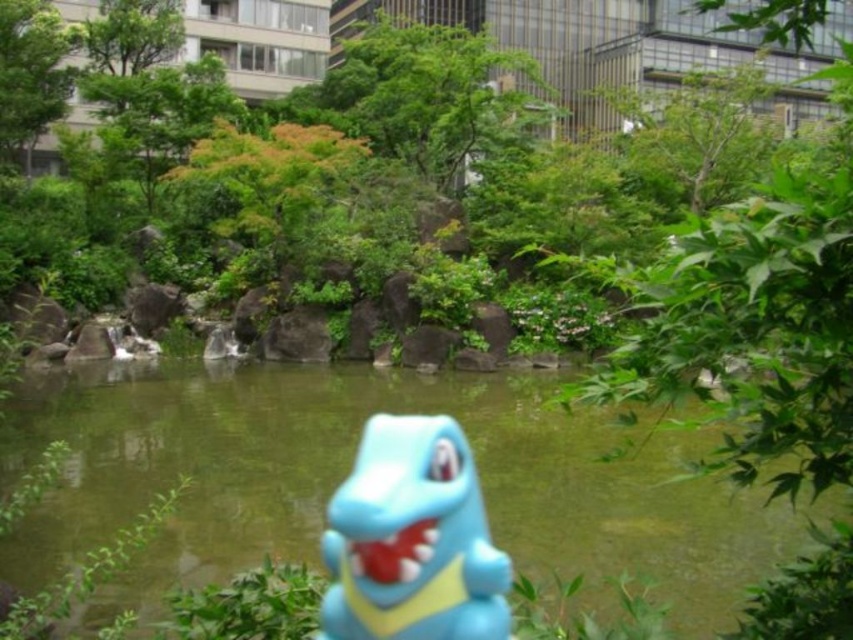
Question: Which point appears farthest from the camera in this image?

Choices:
 (A) (386, 561)
 (B) (138, 589)

Answer: (B)

Question: Does green translucent water at center appear on the left side of blue rubber dinosaur at center?

Choices:
 (A) yes
 (B) no

Answer: (A)

Question: Observing the image, what is the correct spatial positioning of green translucent water at center in reference to blue rubber dinosaur at center?

Choices:
 (A) above
 (B) below

Answer: (B)

Question: Which of the following is the closest to the observer?

Choices:
 (A) (409, 483)
 (B) (202, 452)

Answer: (A)

Question: Can you confirm if green translucent water at center is positioned to the left of blue rubber dinosaur at center?

Choices:
 (A) yes
 (B) no

Answer: (A)